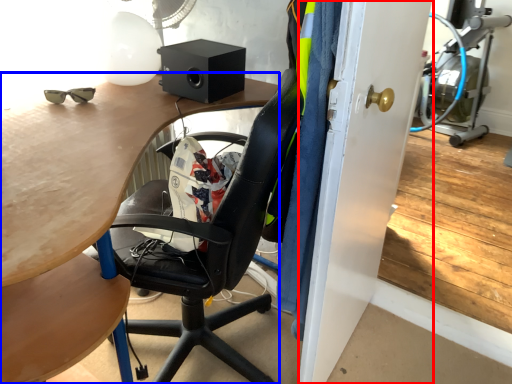
Question: Which of the following is the closest to the observer, glass door (highlighted by a red box) or desk (highlighted by a blue box)?

Choices:
 (A) glass door
 (B) desk

Answer: (B)